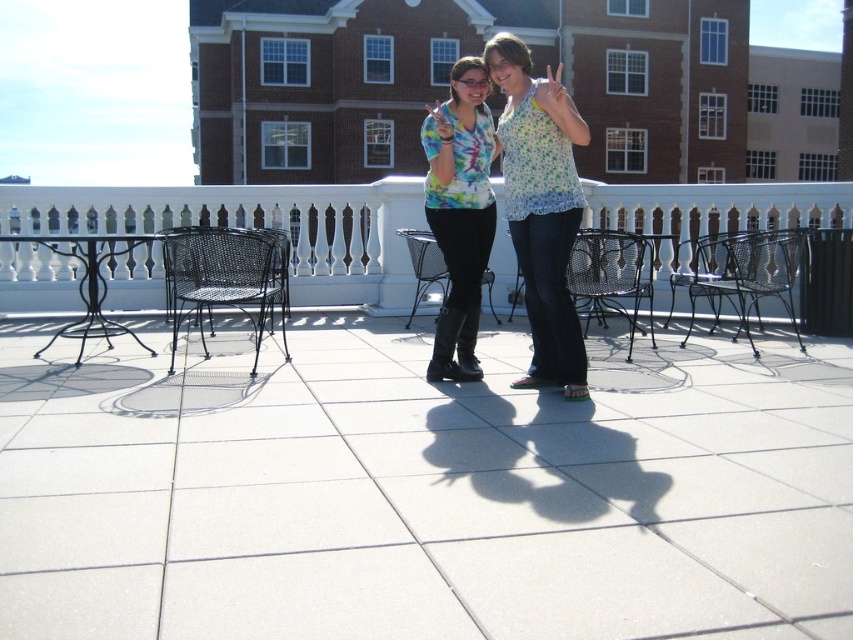
Who is more distant from viewer, (514,113) or (440,122)?

Positioned behind is point (440,122).

Does floral fabric blouse at center appear on the left side of tie-dye fabric shirt at center?

Incorrect, floral fabric blouse at center is not on the left side of tie-dye fabric shirt at center.

Is point (534, 339) less distant than point (469, 200)?

No, it is behind (469, 200).

Find the location of `floral fabric blouse at center`. floral fabric blouse at center is located at coordinates (541, 208).

Consider the image. Does black metal bench at right appear on the right side of black metal chair at center?

Correct, you'll find black metal bench at right to the right of black metal chair at center.

Between point (723, 272) and point (418, 269), which one is positioned behind?

Positioned behind is point (418, 269).

You are a GUI agent. You are given a task and a screenshot of the screen. Output one action in this format:
    pyautogui.click(x=<x>, y=<y>)
    Task: Click on the black metal bench at right
    Image resolution: width=853 pixels, height=640 pixels.
    Given the screenshot: What is the action you would take?
    pyautogui.click(x=741, y=275)

Between white wrought iron railing at center and black metal chair at center, which one has less height?

black metal chair at center is shorter.

Does white wrought iron railing at center come in front of black metal chair at center?

Yes, it is in front of black metal chair at center.

Identify the location of white wrought iron railing at center. (256, 225).